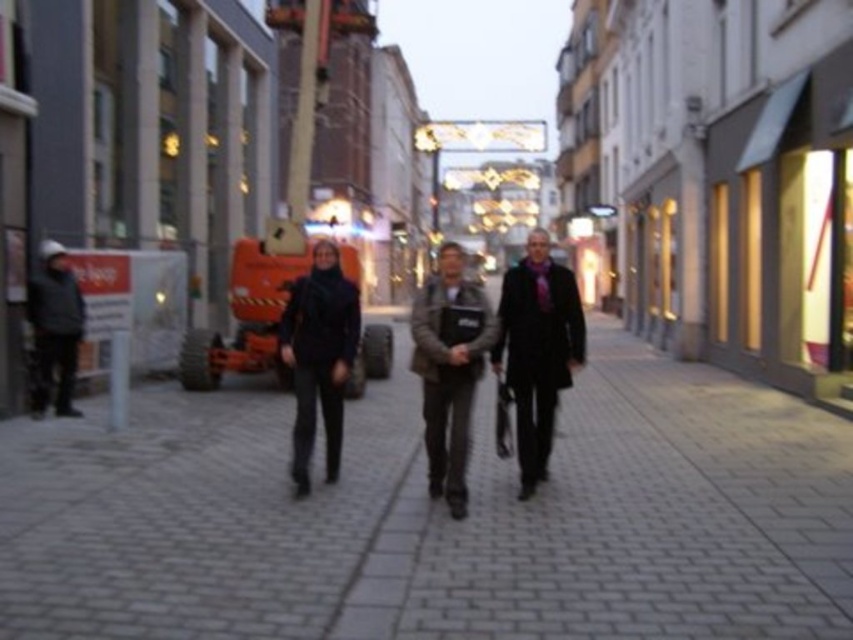
Can you confirm if dark brown leather jacket at center is smaller than black matte suit at center?

Incorrect, dark brown leather jacket at center is not smaller in size than black matte suit at center.

Is dark brown leather jacket at center further to the viewer compared to black matte suit at center?

No, it is not.

Which is in front, point (473, 362) or point (329, 312)?

Positioned in front is point (473, 362).

The width and height of the screenshot is (853, 640). What are the coordinates of `dark brown leather jacket at center` in the screenshot? It's located at (450, 371).

Can you confirm if brown leather jacket at center is smaller than black matte suit at center?

No.

Does brown leather jacket at center have a larger size compared to black matte suit at center?

Indeed, brown leather jacket at center has a larger size compared to black matte suit at center.

Describe the element at coordinates (450, 369) in the screenshot. This screenshot has height=640, width=853. I see `brown leather jacket at center` at that location.

Identify the location of brown leather jacket at center. The image size is (853, 640). (450, 369).

Who is more distant from viewer, (451, 356) or (424, 433)?

The point (424, 433) is behind.

What do you see at coordinates (450, 371) in the screenshot?
I see `dark brown leather jacket at center` at bounding box center [450, 371].

Locate an element on the screen. This screenshot has width=853, height=640. dark brown leather jacket at center is located at coordinates (450, 371).